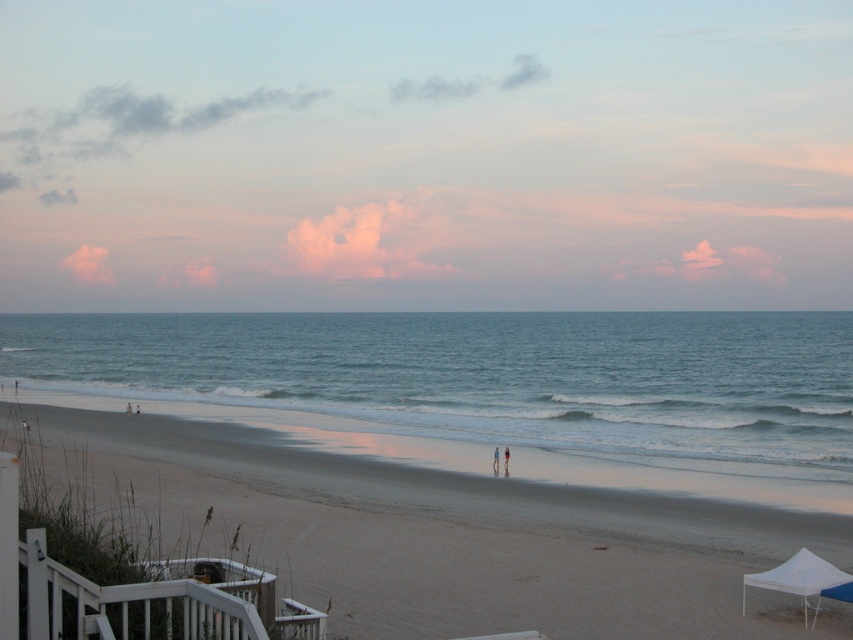
Where is `blue water at center`? Image resolution: width=853 pixels, height=640 pixels. blue water at center is located at coordinates click(491, 376).

Locate an element on the screen. The height and width of the screenshot is (640, 853). blue water at center is located at coordinates (491, 376).

Can you confirm if white wooden railing at lower left is positioned above white fabric tent at lower right?

Yes.

Is point (129, 609) farther from viewer compared to point (770, 589)?

No, (129, 609) is in front of (770, 589).

Locate an element on the screen. This screenshot has height=640, width=853. white wooden railing at lower left is located at coordinates (134, 593).

Find the location of `sandy beach at lower center`. sandy beach at lower center is located at coordinates (451, 536).

Does sandy beach at lower center appear over white fabric tent at lower right?

No.

Where is `sandy beach at lower center`? sandy beach at lower center is located at coordinates (451, 536).